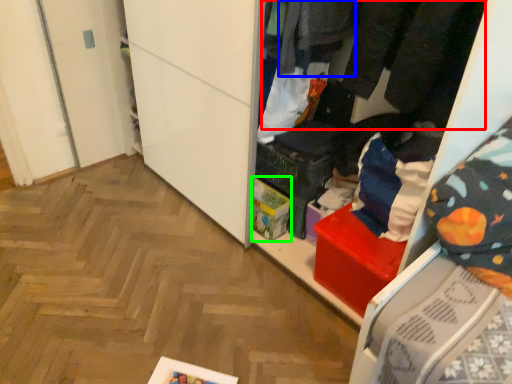
Question: Which is farther away from clothing (highlighted by a red box)? clothing (highlighted by a blue box) or storage box (highlighted by a green box)?

Choices:
 (A) clothing
 (B) storage box

Answer: (B)